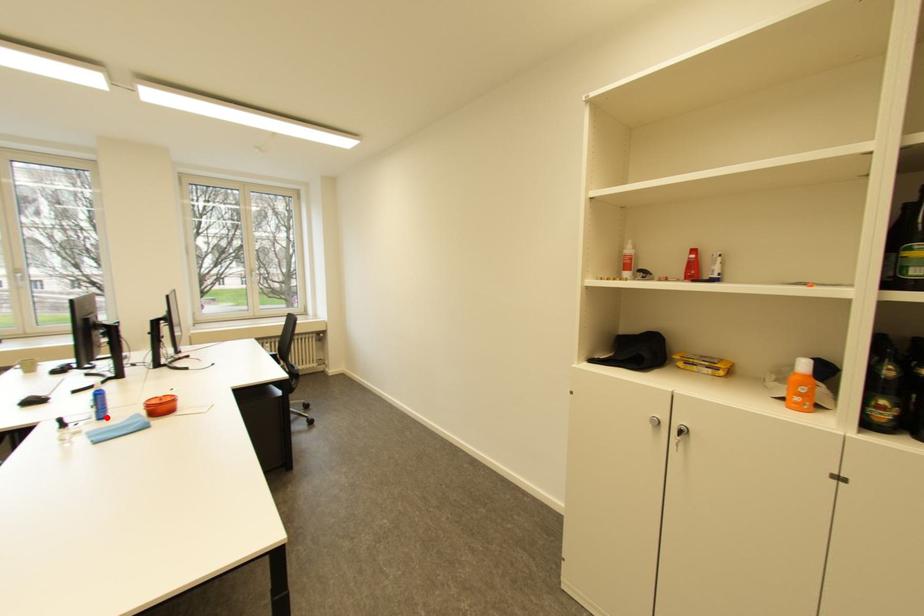
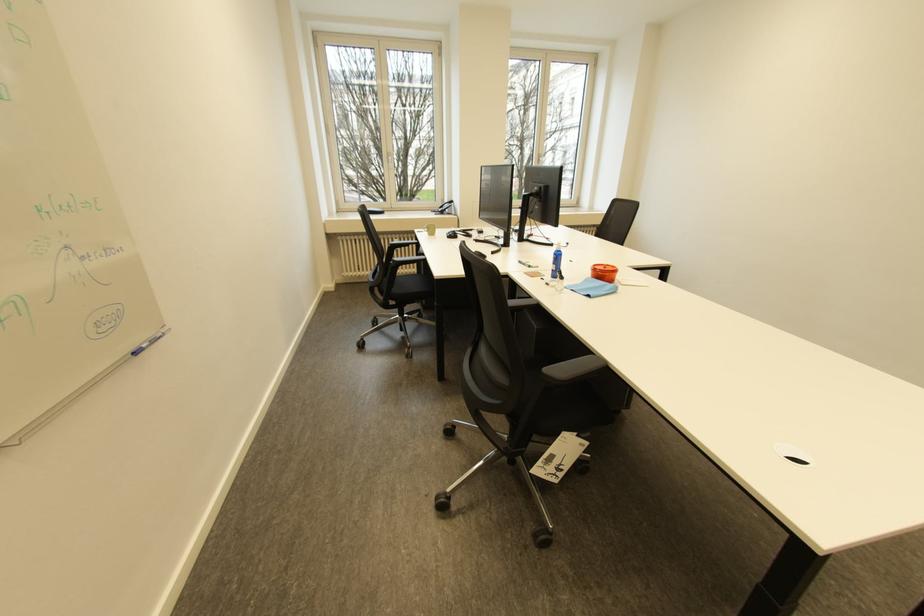
Question: I am providing you with two images of the same scene from different viewpoints. A red point is marked on the first image. At the location where the point appears in image 1, is it still visible in image 2?

Choices:
 (A) Yes
 (B) No

Answer: (A)